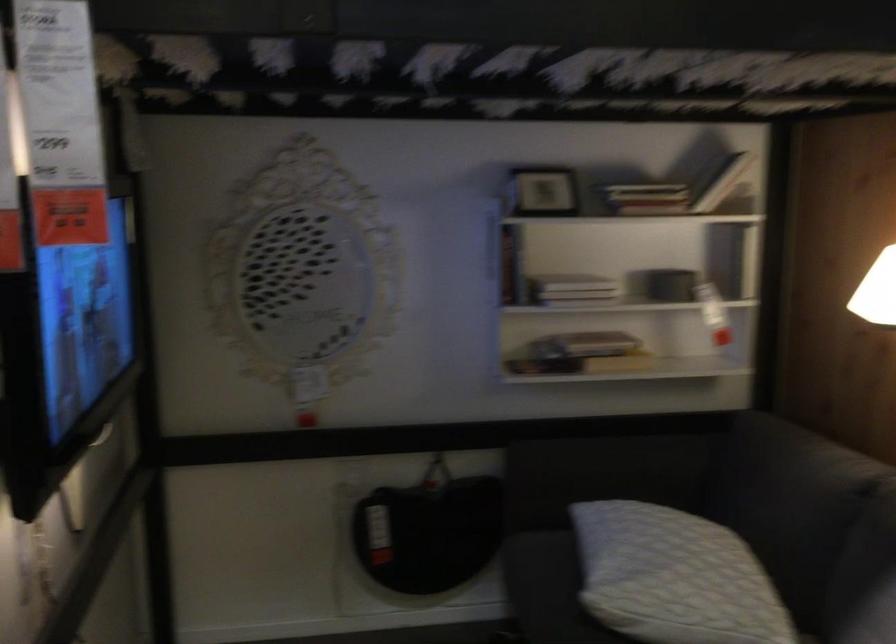
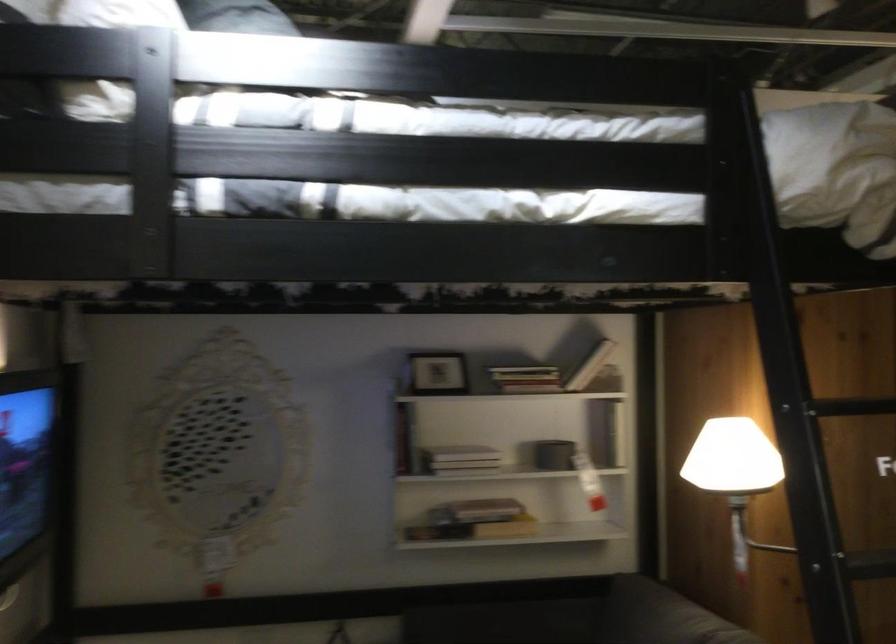
Find the pixel in the second image that matches [565,278] in the first image.

(460, 453)